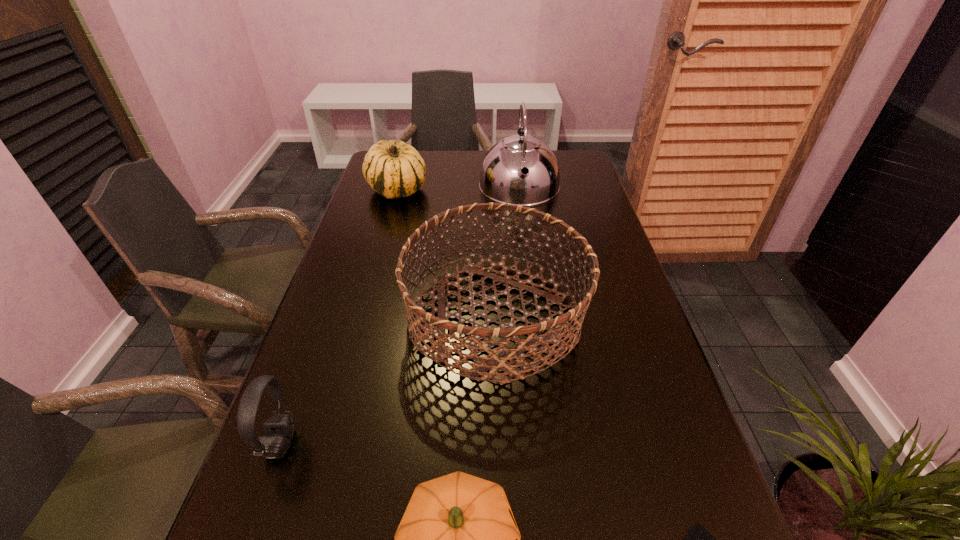
Find the location of `kettle`. kettle is located at coordinates (521, 170).

This screenshot has width=960, height=540. In order to click on the fourth nearest object in this screenshot , I will do `click(560, 324)`.

I want to click on the left gourd, so click(x=394, y=169).

Identify the location of the third nearest object. The image size is (960, 540). (279, 428).

Locate an element on the screen. vacant region located 0.290m from the spout of the kettle is located at coordinates (530, 270).

Locate an element on the screen. Image resolution: width=960 pixels, height=540 pixels. vacant area situated on the front of the basket is located at coordinates (501, 438).

Locate an element on the screen. The width and height of the screenshot is (960, 540). vacant space located on the right of the left gourd is located at coordinates (468, 190).

Find the location of a particular element. Image resolution: width=960 pixels, height=540 pixels. vacant space located 0.340m on the front-facing side of the third nearest object is located at coordinates pos(479,443).

What are the coordinates of `kettle that is positioned at the far edge` in the screenshot? It's located at (521, 170).

Find the location of a particular element. gourd present at the far edge is located at coordinates (394, 169).